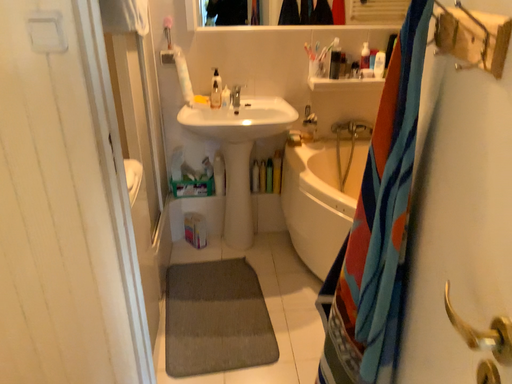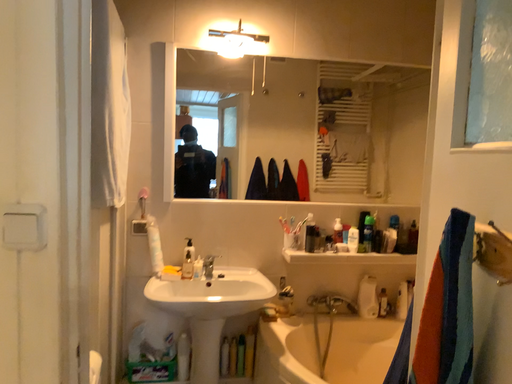
Question: How did the camera likely rotate when shooting the video?

Choices:
 (A) rotated left
 (B) rotated right

Answer: (B)